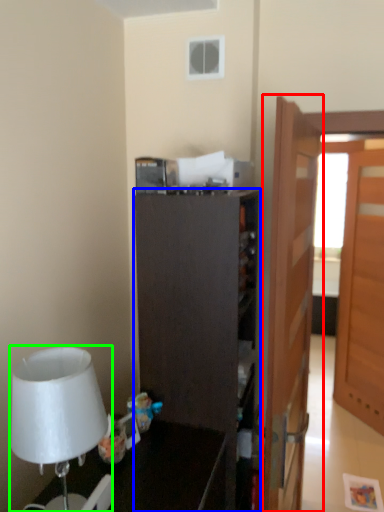
Question: Which object is positioned farthest from door (highlighted by a red box)? Select from cabinetry (highlighted by a blue box) and lamp (highlighted by a green box).

Choices:
 (A) cabinetry
 (B) lamp

Answer: (B)